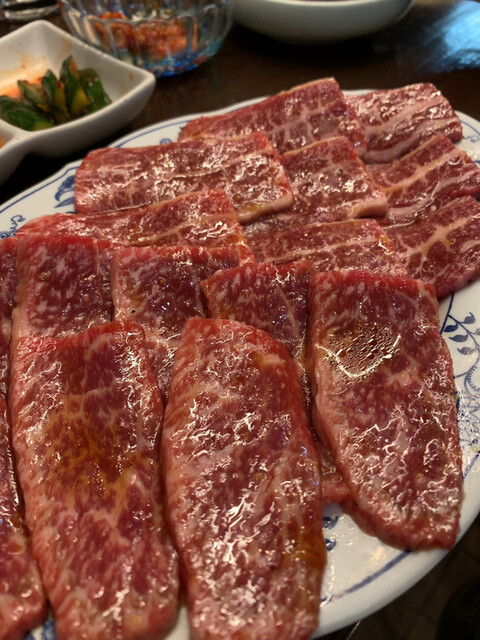
I want to click on plate, so click(x=344, y=546).